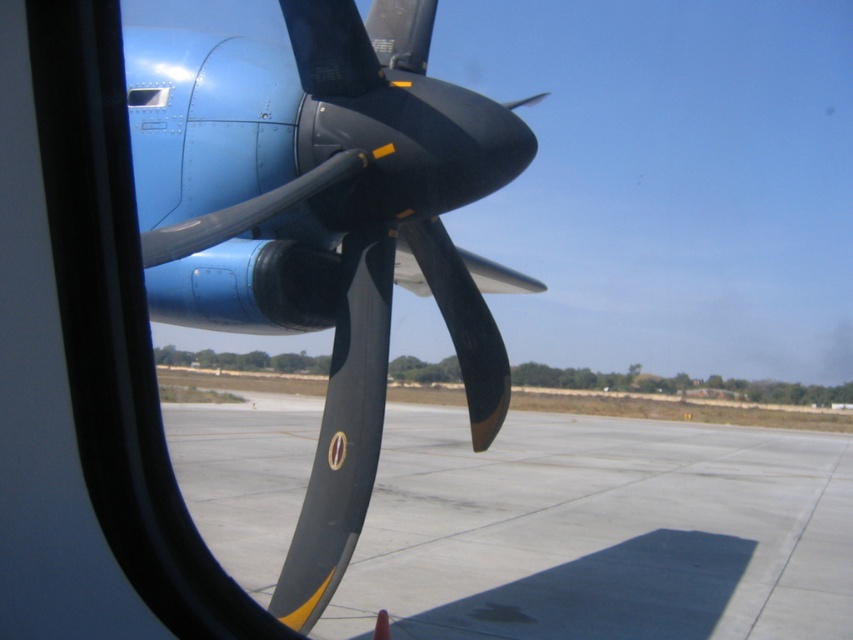
This screenshot has height=640, width=853. Find the location of `matte black propeller at center`. matte black propeller at center is located at coordinates (361, 243).

Between matte black propeller at center and transparent glass airplane window at upper left, which one appears on the right side from the viewer's perspective?

From the viewer's perspective, matte black propeller at center appears more on the right side.

Measure the distance between point (209, 253) and camera.

Point (209, 253) is 3.37 meters away from camera.

This screenshot has height=640, width=853. I want to click on matte black propeller at center, so click(x=361, y=243).

Can you confirm if gray concrete tarmac at center is smaller than transparent glass airplane window at upper left?

Actually, gray concrete tarmac at center might be larger than transparent glass airplane window at upper left.

Is gray concrete tarmac at center below transparent glass airplane window at upper left?

Correct, gray concrete tarmac at center is located below transparent glass airplane window at upper left.

Locate an element on the screen. This screenshot has height=640, width=853. gray concrete tarmac at center is located at coordinates (601, 531).

Is point (466, 598) closer to viewer compared to point (229, 220)?

No, it is behind (229, 220).

Can you confirm if gray concrete tarmac at center is positioned to the right of matte black propeller at center?

Yes, gray concrete tarmac at center is to the right of matte black propeller at center.

I want to click on gray concrete tarmac at center, so click(601, 531).

I want to click on gray concrete tarmac at center, so click(601, 531).